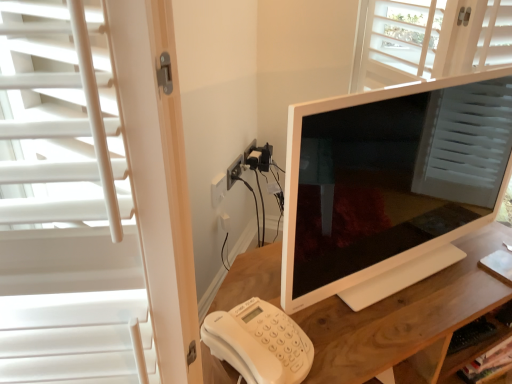
In order to click on vacant area that lies between white plastic phone at lower left and white glossy monitor at center in this screenshot , I will do `click(390, 305)`.